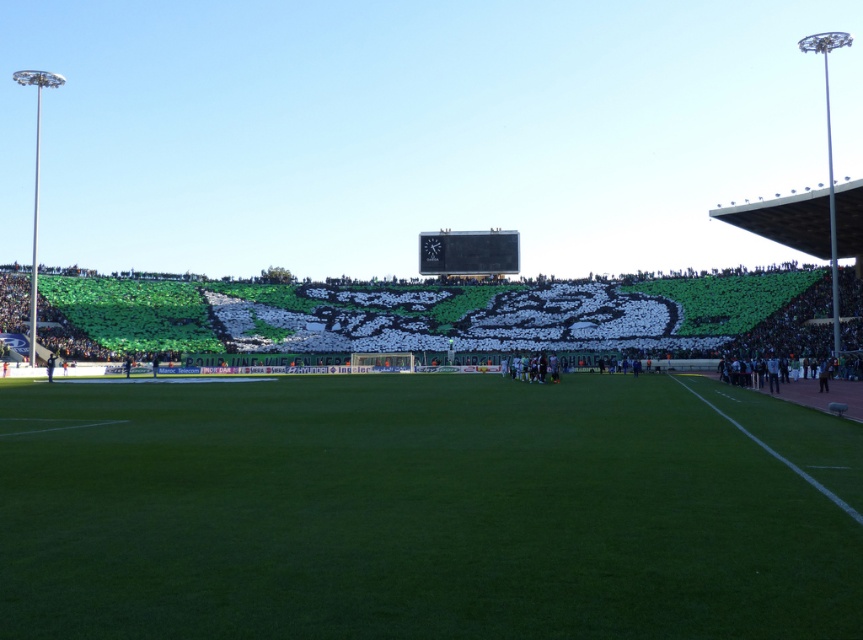
Question: Is green artificial turf at center wider than black glossy scoreboard at center?

Choices:
 (A) yes
 (B) no

Answer: (A)

Question: Which point appears closest to the camera in this image?

Choices:
 (A) (173, 625)
 (B) (465, 244)

Answer: (A)

Question: Which of the following is the farthest from the observer?

Choices:
 (A) (7, 396)
 (B) (512, 269)

Answer: (B)

Question: Does green artificial turf at center have a greater width compared to black glossy scoreboard at center?

Choices:
 (A) yes
 (B) no

Answer: (A)

Question: Can you confirm if green artificial turf at center is thinner than black glossy scoreboard at center?

Choices:
 (A) yes
 (B) no

Answer: (B)